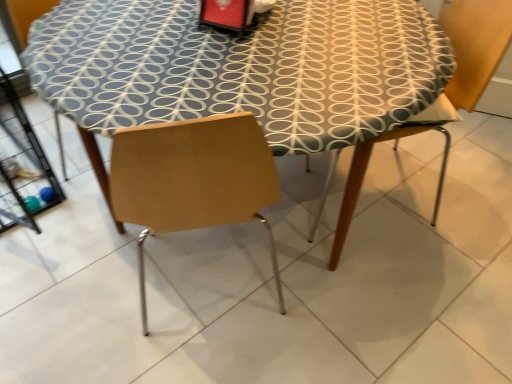
You are a GUI agent. You are given a task and a screenshot of the screen. Output one action in this format:
    pyautogui.click(x=<x>, y=<y>)
    Task: Click on the vacant point to the right of wooden chair at right
    Image resolution: width=512 pixels, height=384 pixels.
    Given the screenshot: What is the action you would take?
    pyautogui.click(x=467, y=180)